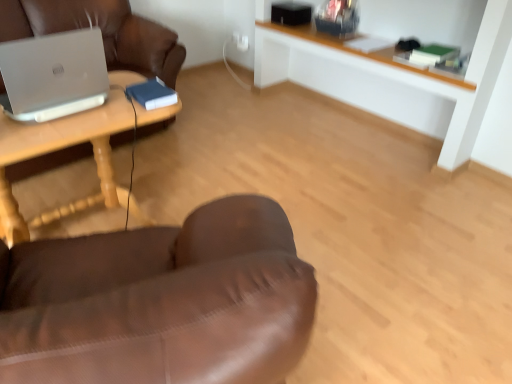
Question: Is white wood shelf at upper center situated inside silver metallic laptop at left or outside?

Choices:
 (A) outside
 (B) inside

Answer: (A)

Question: Is point (382, 66) positioned closer to the camera than point (74, 36)?

Choices:
 (A) farther
 (B) closer

Answer: (A)

Question: Based on their relative distances, which object is farther from the white wood shelf at upper center?

Choices:
 (A) wooden table at left
 (B) silver metallic laptop at left

Answer: (B)

Question: Considering the real-world distances, which object is closest to the wooden table at left?

Choices:
 (A) silver metallic laptop at left
 (B) white wood shelf at upper center

Answer: (A)